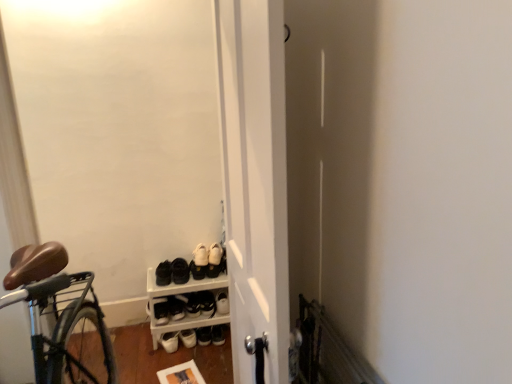
Locate an element on the screen. Image resolution: width=512 pixels, height=384 pixels. free spot in front of white plastic shoe rack at lower center is located at coordinates (169, 363).